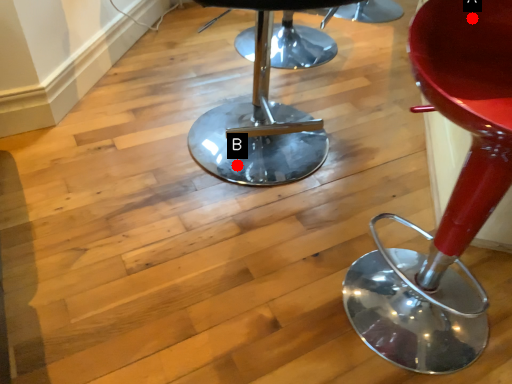
Question: Two points are circled on the image, labeled by A and B beside each circle. Which point is farther to the camera?

Choices:
 (A) A is further
 (B) B is further

Answer: (B)